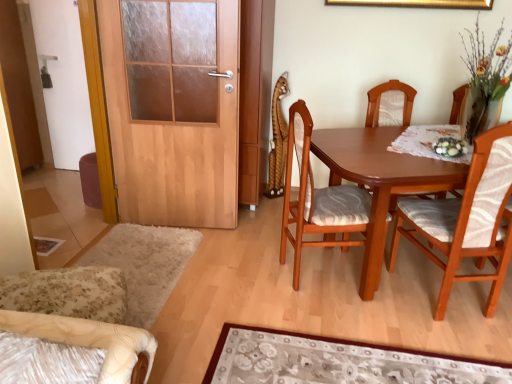
Where is `vacant space that's between wooden door at left and wooden chair with patterned cushion at center, positioned as the third chair in right-to-left order`? This screenshot has height=384, width=512. vacant space that's between wooden door at left and wooden chair with patterned cushion at center, positioned as the third chair in right-to-left order is located at coordinates (246, 253).